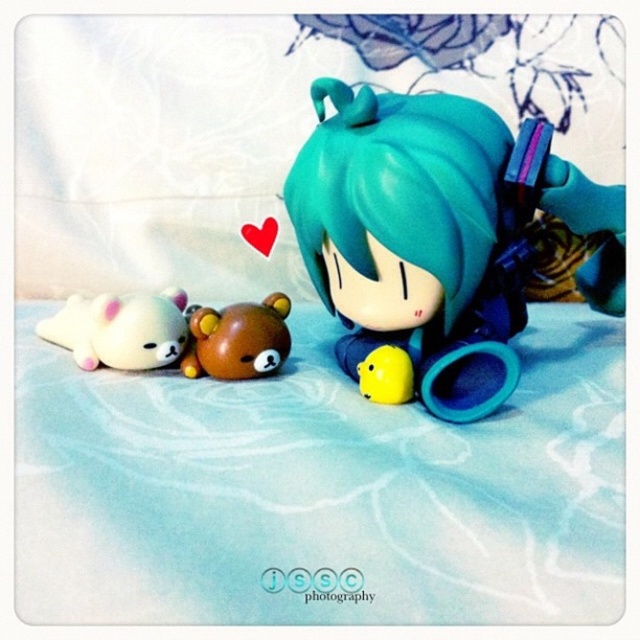
Question: Is brown plush bear at center thinner than yellow matte plush at center?

Choices:
 (A) yes
 (B) no

Answer: (B)

Question: Among these points, which one is farthest from the camera?

Choices:
 (A) (387, 356)
 (B) (209, 358)

Answer: (B)

Question: Based on their relative distances, which object is nearer to the brown plush bear at center?

Choices:
 (A) white plush at left
 (B) teal glossy figurine at center

Answer: (A)

Question: Is teal glossy figurine at center to the left of yellow matte plush at center from the viewer's perspective?

Choices:
 (A) yes
 (B) no

Answer: (B)

Question: Is teal glossy figurine at center above yellow matte plush at center?

Choices:
 (A) yes
 (B) no

Answer: (A)

Question: Which of these objects is positioned farthest from the white plush at left?

Choices:
 (A) brown plush bear at center
 (B) yellow matte plush at center
 (C) teal glossy figurine at center

Answer: (C)